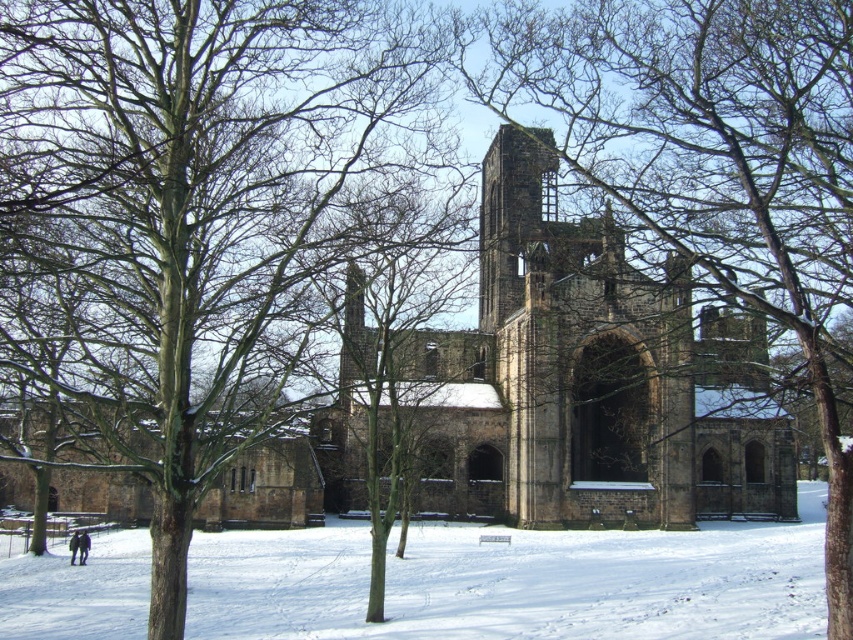
Question: Which point is farther from the camera taking this photo?

Choices:
 (A) (838, 547)
 (B) (84, 561)
 (C) (136, 632)
 (D) (517, 337)

Answer: (D)

Question: Is the position of brown stone church at center less distant than that of dark blue jacket at lower left?

Choices:
 (A) yes
 (B) no

Answer: (A)

Question: Can you confirm if brown bark tree at center is thinner than dark brown leather jacket at lower left?

Choices:
 (A) no
 (B) yes

Answer: (A)

Question: Which object is closer to the camera taking this photo?

Choices:
 (A) white powdery snow at lower center
 (B) dark brown leather jacket at lower left
 (C) brown bark tree at center

Answer: (C)

Question: Which of the following is the closest to the observer?

Choices:
 (A) (403, 349)
 (B) (646, 24)
 (C) (187, 390)

Answer: (C)

Question: Observing the image, what is the correct spatial positioning of brown stone church at center in reference to dark brown leather jacket at lower left?

Choices:
 (A) right
 (B) left

Answer: (A)